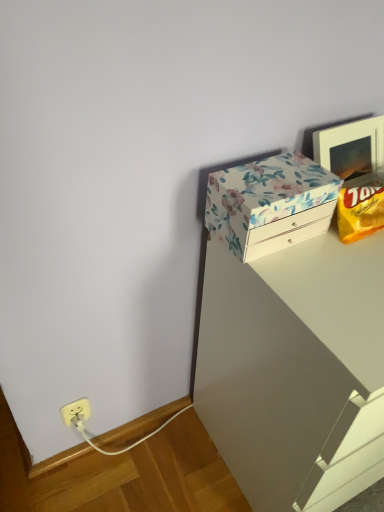
Question: From the image's perspective, is yellow matte chip bag at upper right located beneath floral paper-covered box at upper right?

Choices:
 (A) yes
 (B) no

Answer: (A)

Question: From a real-world perspective, is yellow matte chip bag at upper right physically above floral paper-covered box at upper right?

Choices:
 (A) yes
 (B) no

Answer: (B)

Question: Considering the relative sizes of yellow matte chip bag at upper right and floral paper-covered box at upper right in the image provided, is yellow matte chip bag at upper right thinner than floral paper-covered box at upper right?

Choices:
 (A) no
 (B) yes

Answer: (B)

Question: Can you confirm if yellow matte chip bag at upper right is bigger than floral paper-covered box at upper right?

Choices:
 (A) no
 (B) yes

Answer: (A)

Question: Is yellow matte chip bag at upper right located outside floral paper-covered box at upper right?

Choices:
 (A) yes
 (B) no

Answer: (A)

Question: Do you think floral paper-covered box at upper right is within white glossy vanity at upper right, or outside of it?

Choices:
 (A) outside
 (B) inside

Answer: (A)

Question: From a real-world perspective, relative to white glossy vanity at upper right, is floral paper-covered box at upper right vertically above or below?

Choices:
 (A) below
 (B) above

Answer: (B)

Question: From the image's perspective, is floral paper-covered box at upper right located above or below white glossy vanity at upper right?

Choices:
 (A) above
 (B) below

Answer: (A)

Question: Does point (240, 223) appear closer or farther from the camera than point (226, 289)?

Choices:
 (A) farther
 (B) closer

Answer: (B)

Question: Is point (364, 212) closer or farther from the camera than point (258, 252)?

Choices:
 (A) closer
 (B) farther

Answer: (B)

Question: Choose the correct answer: Is yellow matte chip bag at upper right inside floral paper-covered box at upper right or outside it?

Choices:
 (A) outside
 (B) inside

Answer: (A)

Question: Visually, is yellow matte chip bag at upper right positioned to the left or to the right of floral paper-covered box at upper right?

Choices:
 (A) left
 (B) right

Answer: (B)

Question: From the image's perspective, is yellow matte chip bag at upper right above or below floral paper-covered box at upper right?

Choices:
 (A) below
 (B) above

Answer: (A)

Question: From the image's perspective, is yellow matte chip bag at upper right positioned above or below white glossy vanity at upper right?

Choices:
 (A) above
 (B) below

Answer: (A)

Question: Is yellow matte chip bag at upper right in front of or behind white glossy vanity at upper right in the image?

Choices:
 (A) behind
 (B) front

Answer: (A)